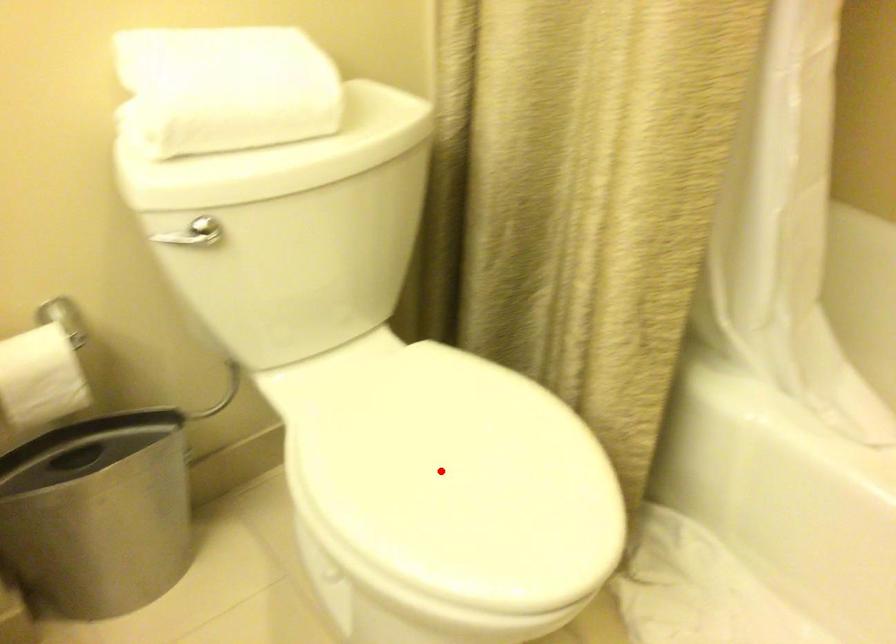
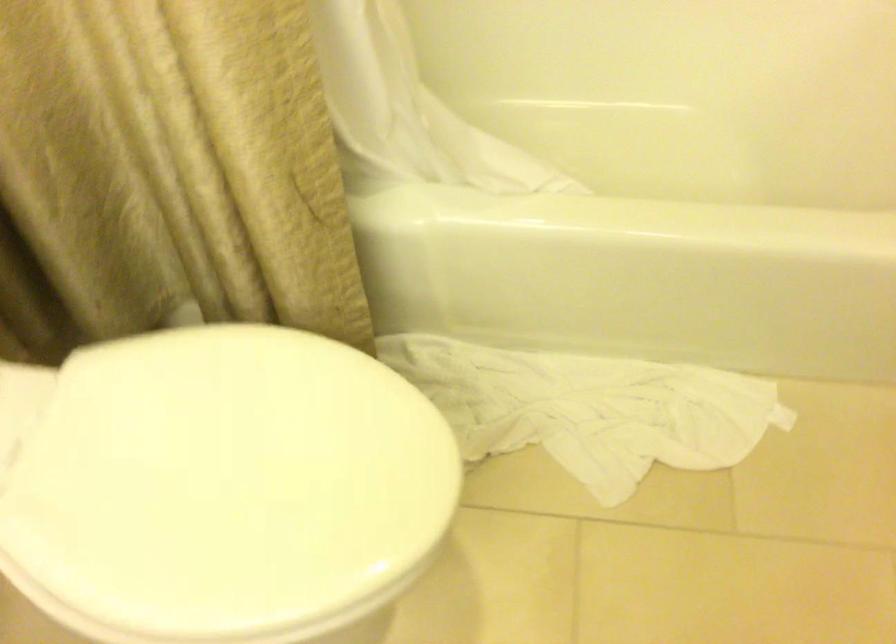
Question: A red point is marked in image1. In image2, is the corresponding 3D point closer to the camera or farther? Reply with the corresponding letter.

Choices:
 (A) The corresponding 3D point is closer.
 (B) The corresponding 3D point is farther.

Answer: (A)